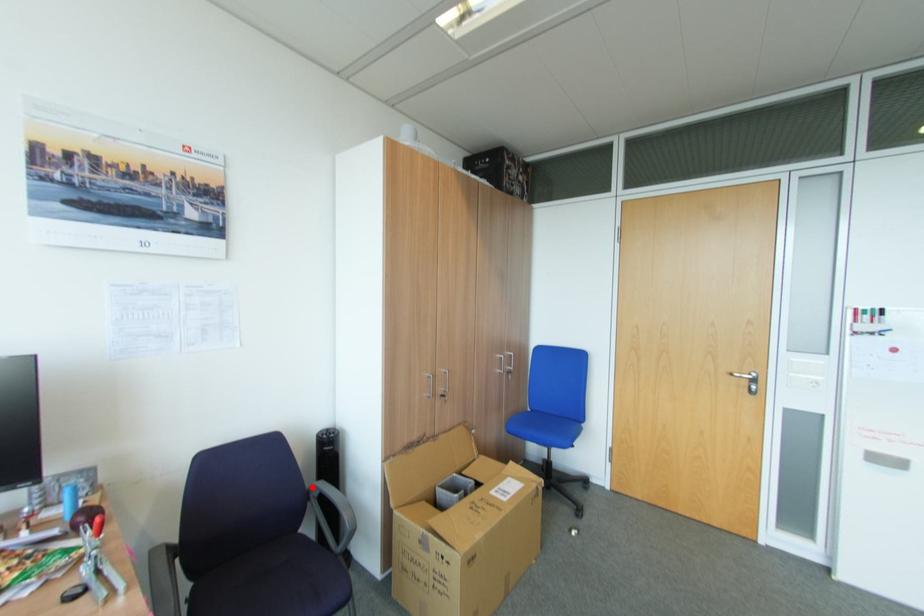
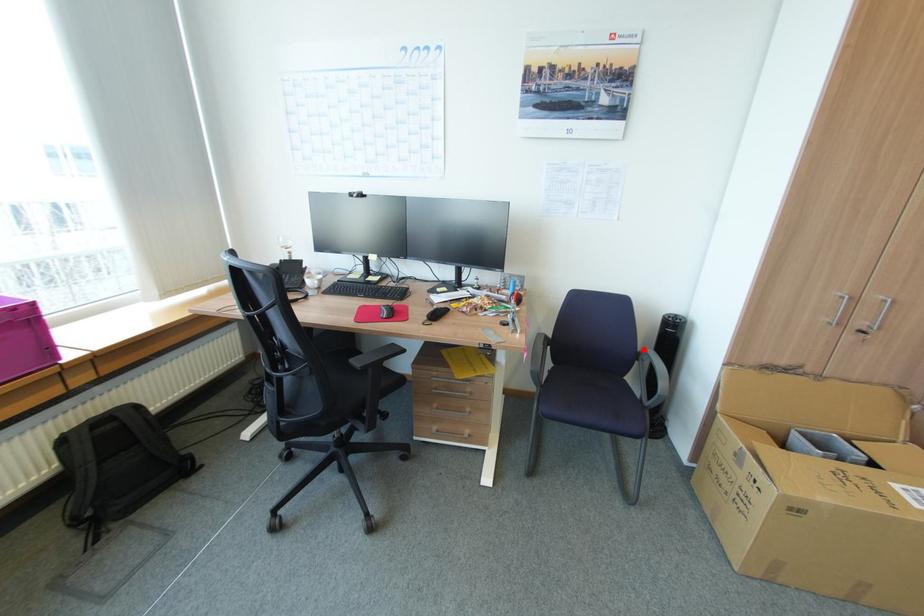
I am providing you with two images of the same scene from different viewpoints. A red point is marked on the first image and another point is marked on the second image. Do the highlighted points in image1 and image2 indicate the same real-world spot?

Yes